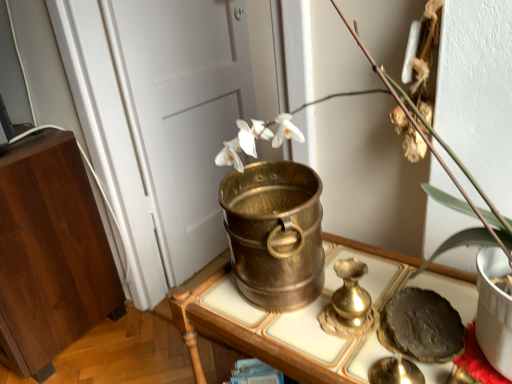
Question: Is white matte door at center oriented towards wooden cabinet at left, the 1th furniture from the left?

Choices:
 (A) no
 (B) yes

Answer: (A)

Question: Is white matte door at center touching wooden cabinet at left, positioned as the second furniture in right-to-left order?

Choices:
 (A) no
 (B) yes

Answer: (A)

Question: Is white matte door at center turned away from wooden cabinet at left, positioned as the second furniture in right-to-left order?

Choices:
 (A) yes
 (B) no

Answer: (B)

Question: From the image's perspective, is white matte door at center located beneath wooden cabinet at left, the first furniture when ordered from back to front?

Choices:
 (A) yes
 (B) no

Answer: (B)

Question: Is white matte door at center smaller than wooden cabinet at left, the second furniture from the front?

Choices:
 (A) yes
 (B) no

Answer: (A)

Question: Can you confirm if white matte door at center is thinner than wooden cabinet at left, the second furniture from the front?

Choices:
 (A) yes
 (B) no

Answer: (A)

Question: Is brass bucket at center, marked as the 2th furniture in a back-to-front arrangement, looking in the opposite direction of wooden cabinet at left, the 1th furniture from the left?

Choices:
 (A) no
 (B) yes

Answer: (A)

Question: Can you confirm if brass bucket at center, the second furniture positioned from the left, is shorter than wooden cabinet at left, the second furniture from the front?

Choices:
 (A) no
 (B) yes

Answer: (B)

Question: Considering the relative sizes of brass bucket at center, the second furniture positioned from the left, and wooden cabinet at left, the first furniture when ordered from back to front, in the image provided, is brass bucket at center, the second furniture positioned from the left, thinner than wooden cabinet at left, the first furniture when ordered from back to front,?

Choices:
 (A) no
 (B) yes

Answer: (B)

Question: Considering the relative sizes of brass bucket at center, the second furniture positioned from the left, and wooden cabinet at left, the first furniture when ordered from back to front, in the image provided, is brass bucket at center, the second furniture positioned from the left, taller than wooden cabinet at left, the first furniture when ordered from back to front,?

Choices:
 (A) yes
 (B) no

Answer: (B)

Question: Could you tell me if brass bucket at center, which is the 1th furniture from right to left, is facing wooden cabinet at left, the second furniture from the front?

Choices:
 (A) no
 (B) yes

Answer: (A)

Question: From a real-world perspective, is brass bucket at center, marked as the 2th furniture in a back-to-front arrangement, physically above wooden cabinet at left, the 1th furniture from the left?

Choices:
 (A) yes
 (B) no

Answer: (B)

Question: Does shiny dark plate at lower right have a lesser height compared to white porcelain vase at center?

Choices:
 (A) no
 (B) yes

Answer: (B)